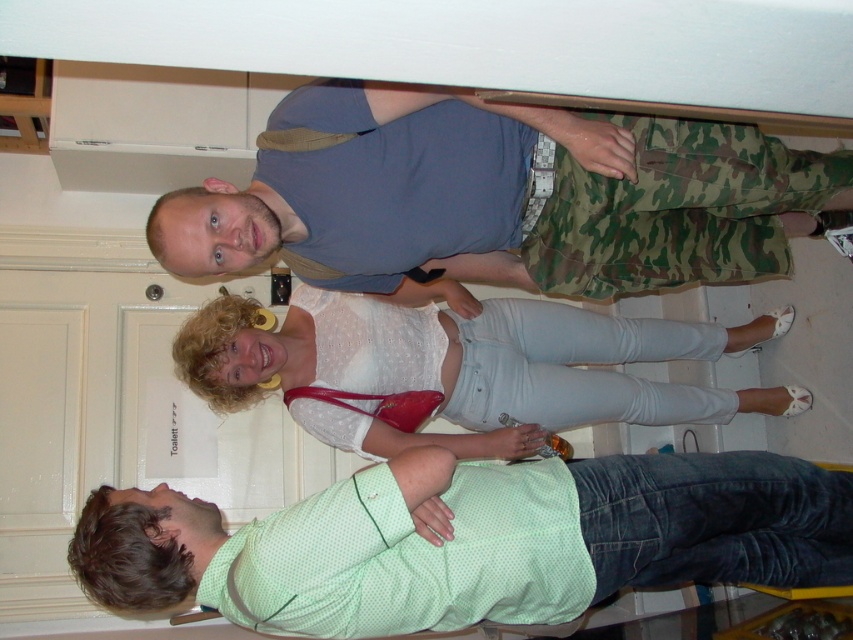
Based on the photo, can you confirm if camo-patterned shorts at upper center is taller than white matte blouse at center?

No, camo-patterned shorts at upper center is not taller than white matte blouse at center.

Which is behind, point (349, 172) or point (178, 353)?

The point (178, 353) is more distant.

This screenshot has height=640, width=853. What are the coordinates of `camo-patterned shorts at upper center` in the screenshot? It's located at (502, 196).

Is green dotted shirt at center wider than white matte blouse at center?

Incorrect, green dotted shirt at center's width does not surpass white matte blouse at center's.

Is green dotted shirt at center to the left of white matte blouse at center from the viewer's perspective?

Yes, green dotted shirt at center is to the left of white matte blouse at center.

Who is more distant from viewer, [393,595] or [276,340]?

The point [276,340] is more distant.

I want to click on green dotted shirt at center, so click(473, 541).

Is point (751, 236) less distant than point (283, 536)?

No, (751, 236) is behind (283, 536).

Describe the element at coordinates (502, 196) in the screenshot. I see `camo-patterned shorts at upper center` at that location.

Is point (561, 184) positioned after point (242, 592)?

Yes, point (561, 184) is farther from viewer.

Identify the location of camo-patterned shorts at upper center. This screenshot has height=640, width=853. (502, 196).